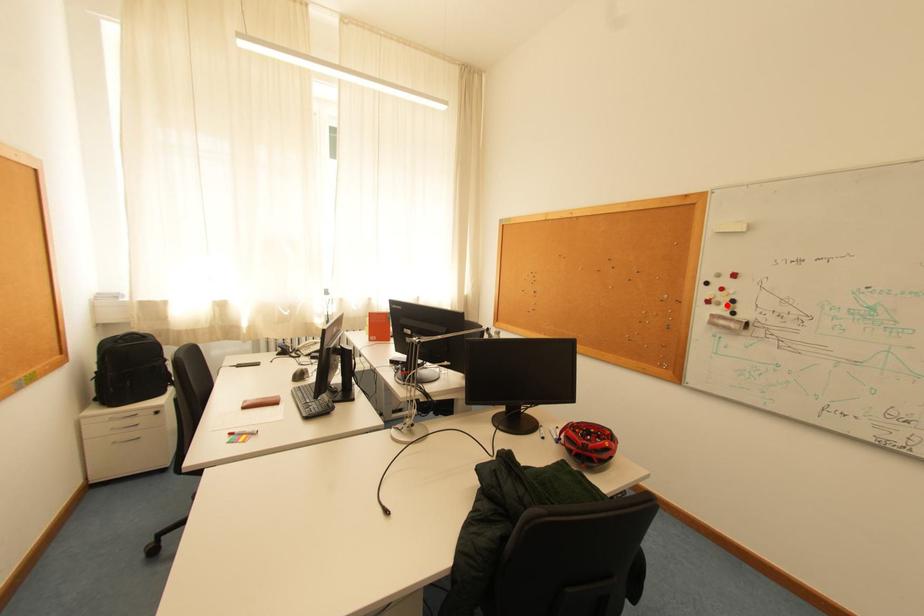
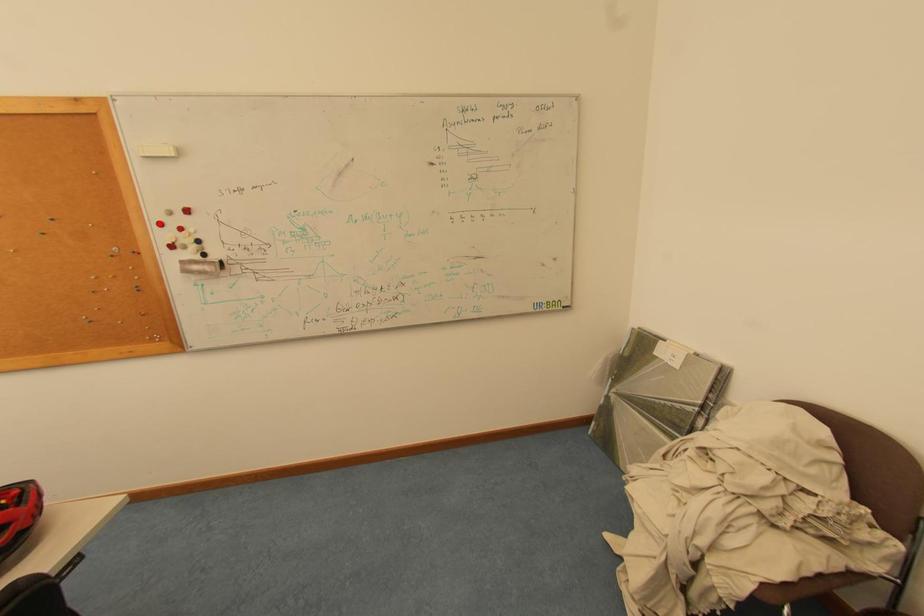
I am providing you with two images of the same scene from different viewpoints. A red point is marked on the first image and another point is marked on the second image. Does the point marked in image1 correspond to the same location as the one in image2?

No